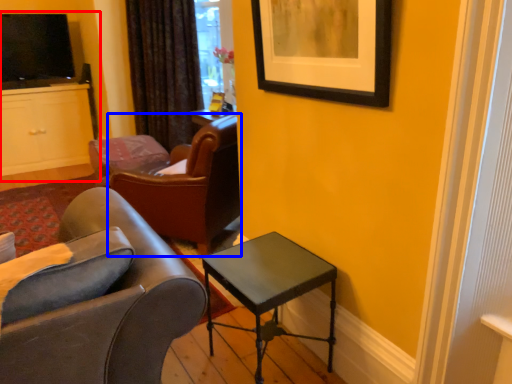
Question: Which object is further to the camera taking this photo, entertainment center (highlighted by a red box) or chair (highlighted by a blue box)?

Choices:
 (A) entertainment center
 (B) chair

Answer: (A)